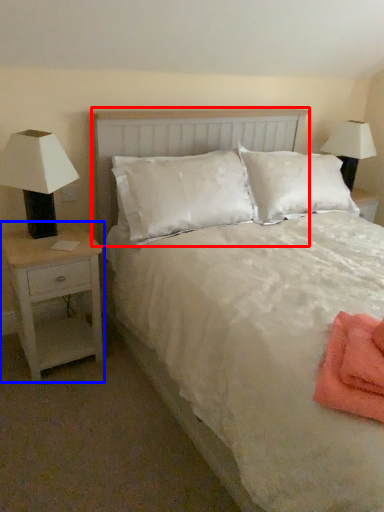
Question: Which object appears closest to the camera in this image, headboard (highlighted by a red box) or nightstand (highlighted by a blue box)?

Choices:
 (A) headboard
 (B) nightstand

Answer: (A)